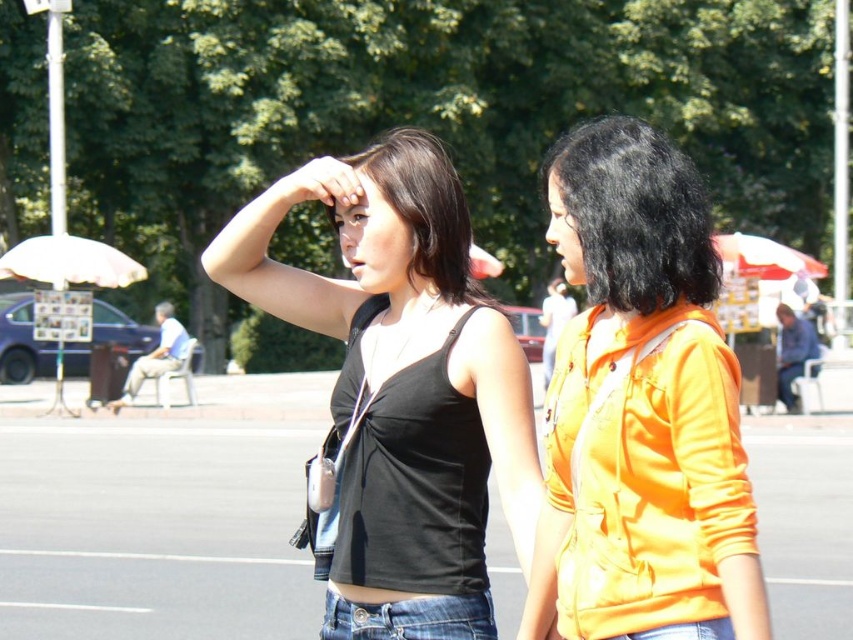
Between black matte tank top at center and jeans at center, which one is positioned higher?

black matte tank top at center

From the picture: Can you confirm if black matte tank top at center is positioned to the left of jeans at center?

Correct, you'll find black matte tank top at center to the left of jeans at center.

Where is `black matte tank top at center`? The height and width of the screenshot is (640, 853). black matte tank top at center is located at coordinates (402, 381).

Is point (585, 225) positioned behind point (697, 280)?

Yes, it is behind point (697, 280).

Can you confirm if orange matte jacket at right is wider than black silky hair at upper right?

In fact, orange matte jacket at right might be narrower than black silky hair at upper right.

Is point (727, 529) closer to camera compared to point (579, 189)?

Yes, it is in front of point (579, 189).

You are a GUI agent. You are given a task and a screenshot of the screen. Output one action in this format:
    pyautogui.click(x=<x>, y=<y>)
    Task: Click on the orange matte jacket at right
    
    Given the screenshot: What is the action you would take?
    pyautogui.click(x=640, y=404)

Is point (306, 301) less distant than point (368, 632)?

That is False.

Identify the location of black matte tank top at center. (402, 381).